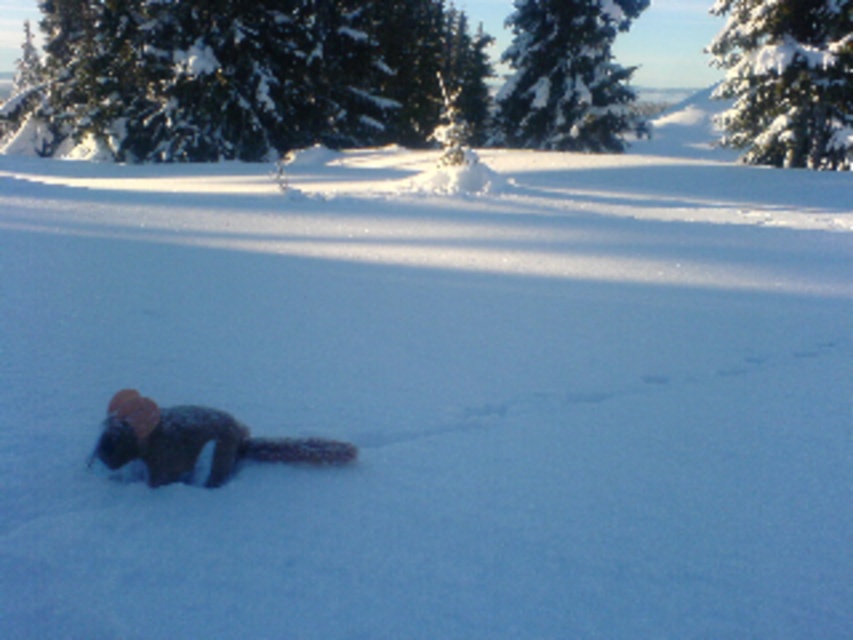
Question: Considering the relative positions of snow-covered evergreen at upper right and snow-covered evergreen at upper center in the image provided, where is snow-covered evergreen at upper right located with respect to snow-covered evergreen at upper center?

Choices:
 (A) left
 (B) right

Answer: (B)

Question: Which is nearer to the snow-covered evergreen at upper center?

Choices:
 (A) fuzzy brown animal at center
 (B) snow-covered evergreen at upper right

Answer: (B)

Question: Does snow-covered evergreen at upper right appear on the left side of fuzzy brown animal at center?

Choices:
 (A) yes
 (B) no

Answer: (B)

Question: Which point is farther to the camera?

Choices:
 (A) (595, 136)
 (B) (728, 93)

Answer: (A)

Question: Among these points, which one is nearest to the camera?

Choices:
 (A) [x=538, y=97]
 (B) [x=724, y=12]
 (C) [x=189, y=449]

Answer: (C)

Question: Can you confirm if snow-covered evergreen at upper center is positioned below fuzzy brown animal at center?

Choices:
 (A) no
 (B) yes

Answer: (A)